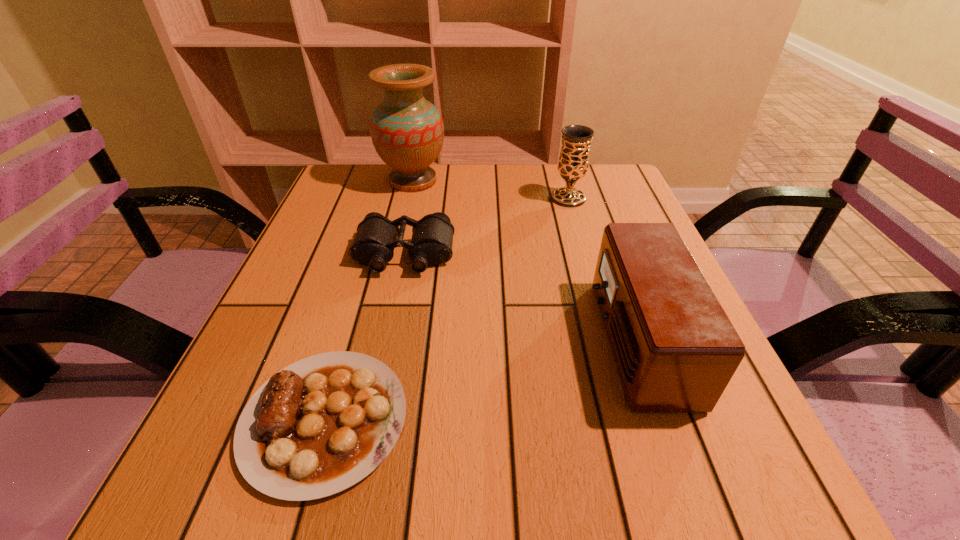
This screenshot has height=540, width=960. In order to click on free spot that satisfies the following two spatial constraints: 1. on the front side of the second tallest object; 2. on the left side of the vase in this screenshot , I will do (409, 198).